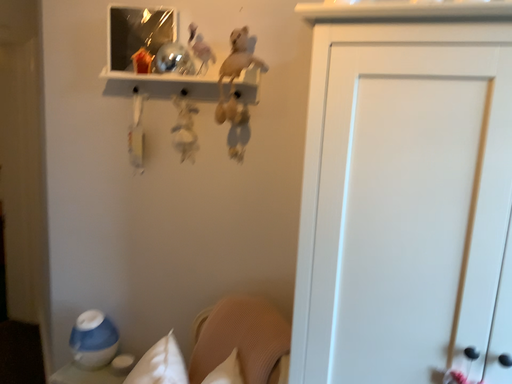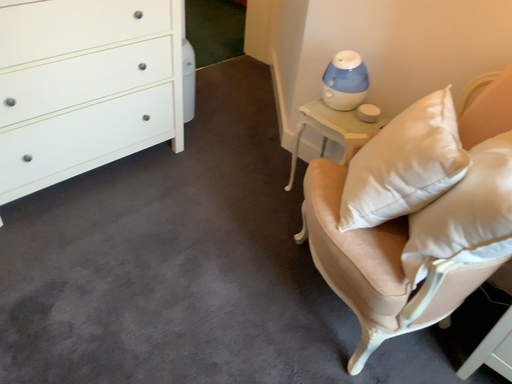
Question: Which way did the camera rotate in the video?

Choices:
 (A) rotated right
 (B) rotated left

Answer: (B)